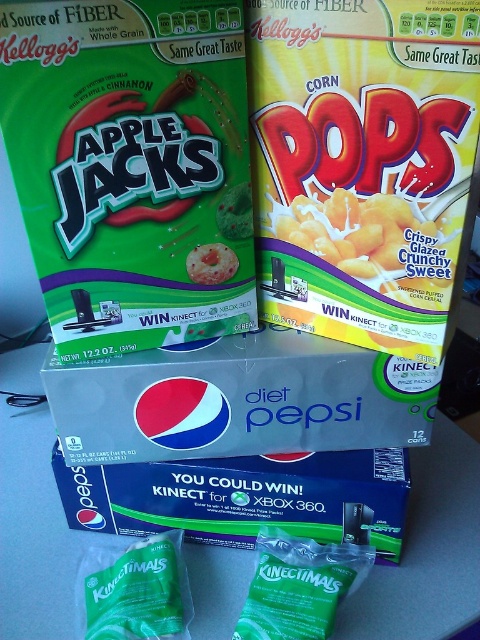
You are organizing a picnic basket and have both the yellow paper corn pops at upper right and the smooth plastic apple at center. Which item should you choose if you want the larger snack?

The yellow paper corn pops at upper right is larger than the smooth plastic apple at center, so you should choose the yellow paper corn pops at upper right for the larger snack.

You are organizing items on a desk and need to place the yellow paper corn pops at upper right and the green matte kinectimals at center. Which item is positioned higher up on the desk?

The yellow paper corn pops at upper right is located above the green matte kinectimals at center, so it is positioned higher up on the desk.

You are organizing items on a desk and need to place a new item between the yellow paper corn pops at upper right and the green matte kinectimals at center. What is the minimum distance you need to maintain between them to fit the new item?

The minimum distance required to place a new item between the yellow paper corn pops at upper right and the green matte kinectimals at center is 20.51 inches, as they are currently 20.51 inches apart.